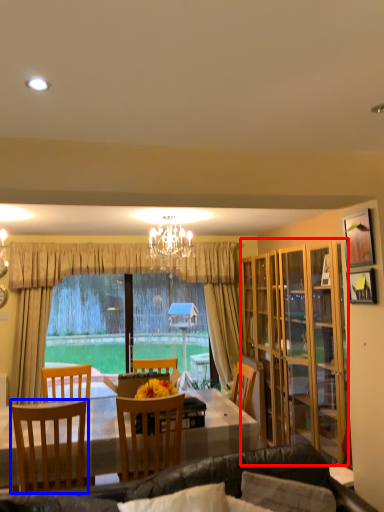
Question: Which of the following is the closest to the observer, cabinetry (highlighted by a red box) or chair (highlighted by a blue box)?

Choices:
 (A) cabinetry
 (B) chair

Answer: (B)